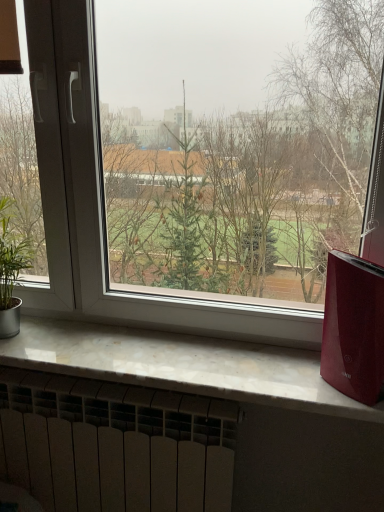
Image resolution: width=384 pixels, height=512 pixels. I want to click on vacant area that lies between transparent glass window at center and shiny red air purifier at right, so click(204, 366).